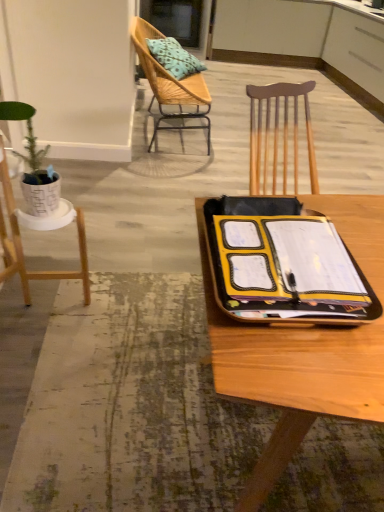
Image resolution: width=384 pixels, height=512 pixels. I want to click on vacant space in front of woven wood chair at upper left, which is counted as the second chair, starting from the front, so click(145, 184).